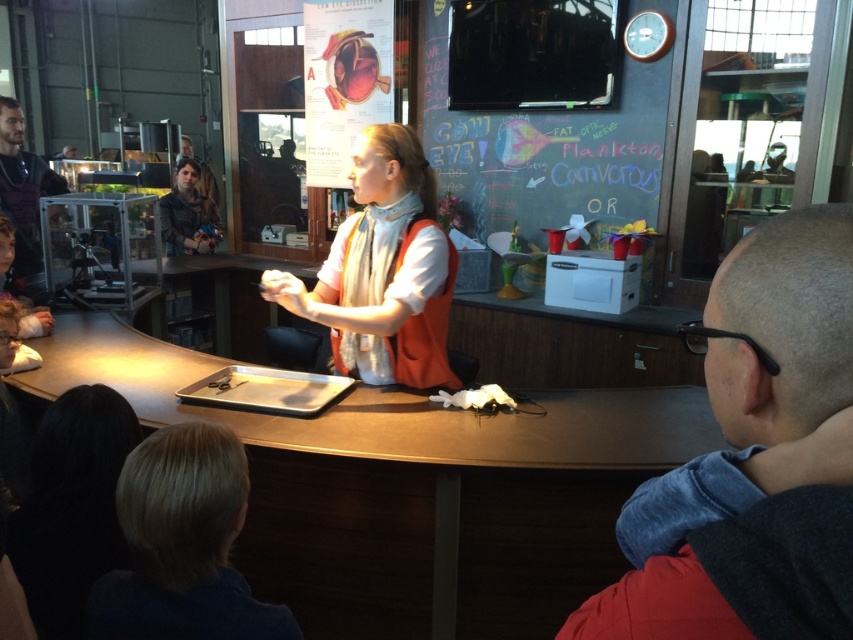
You are a photographer at the back of the room. You want to take a photo of the bald head at center and blonde hair at lower left so that both are clearly visible. Which object should you zoom in on to ensure both are in focus?

The bald head at center has a lesser width compared to blonde hair at lower left, so you should zoom in on the larger object, which is the blonde hair at lower left, to ensure both are in focus.

You are standing at the counter and want to place a small object exactly where the bald head at center is. Where should you place it?

Place the small object at the coordinates point (743, 422) where the bald head at center is located.

You are a photographer trying to capture a closeup of the presenter. You need to ensure that both the blonde hair at lower left and the white matte vest at center are visible in the frame. Which object should you focus on to ensure the narrower one is in focus?

The blonde hair at lower left has a lesser width compared to the white matte vest at center, so you should focus on the blonde hair at lower left to ensure the narrower one is in focus.